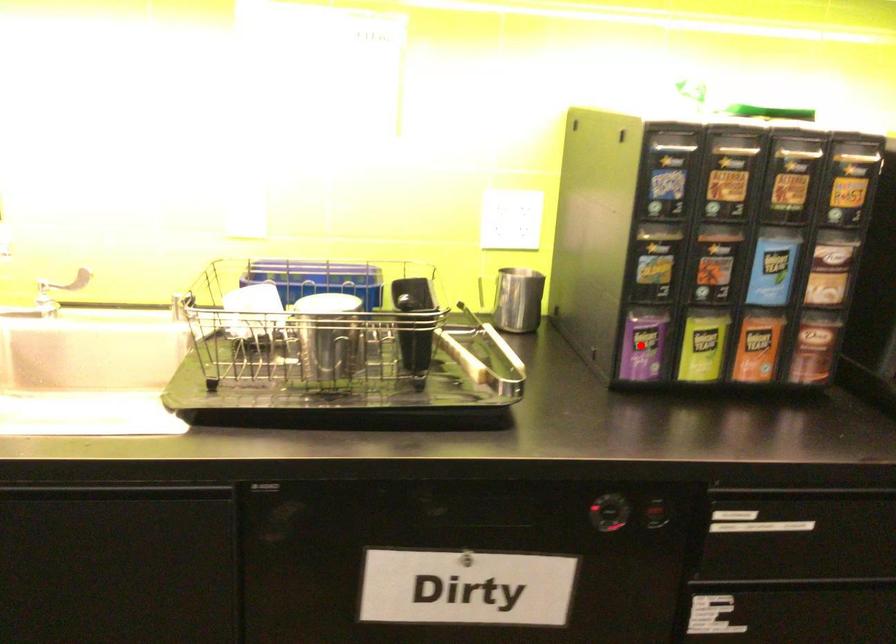
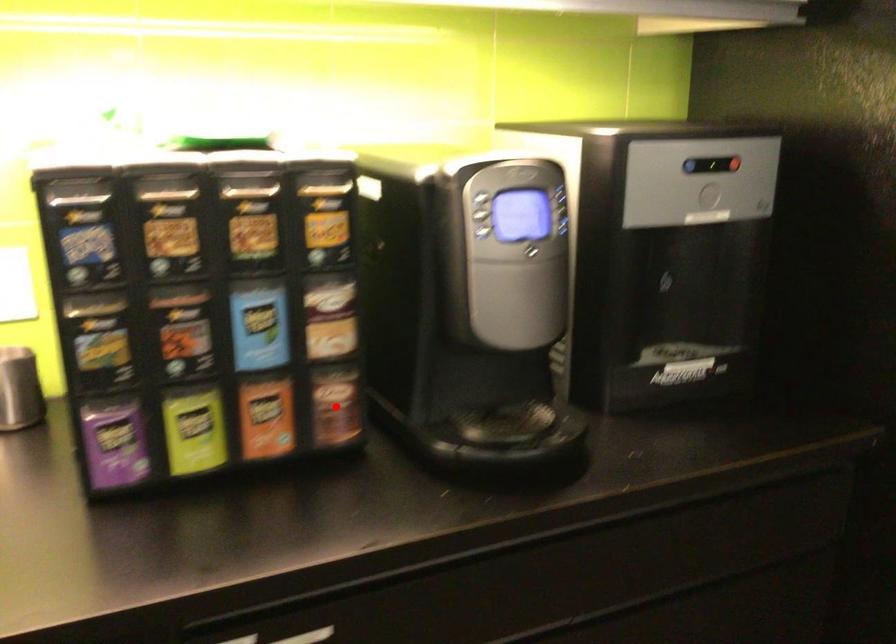
I am providing you with two images of the same scene from different viewpoints. A red point is marked on the first image and another point is marked on the second image. Is the red point in image1 aligned with the point shown in image2?

No